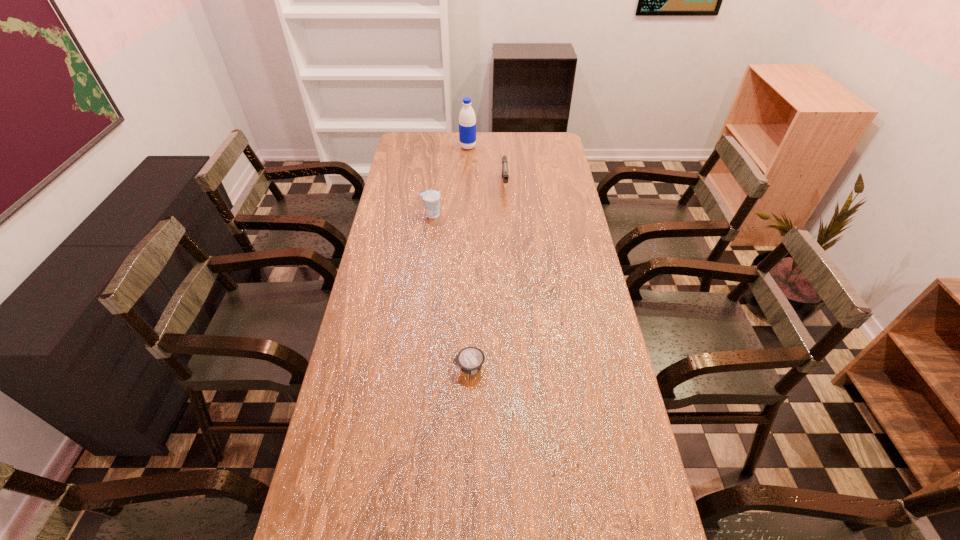
Locate an element on the screen. The height and width of the screenshot is (540, 960). vacant space that satisfies the following two spatial constraints: 1. on the back side of the tallest object; 2. on the left side of the taller yogurt is located at coordinates (440, 147).

Identify the location of vacant area that satisfies the following two spatial constraints: 1. on the front side of the taller yogurt; 2. on the left side of the shorter yogurt. (413, 367).

Locate an element on the screen. free space that satisfies the following two spatial constraints: 1. on the back side of the second nearest object; 2. on the right side of the farthest object is located at coordinates (440, 147).